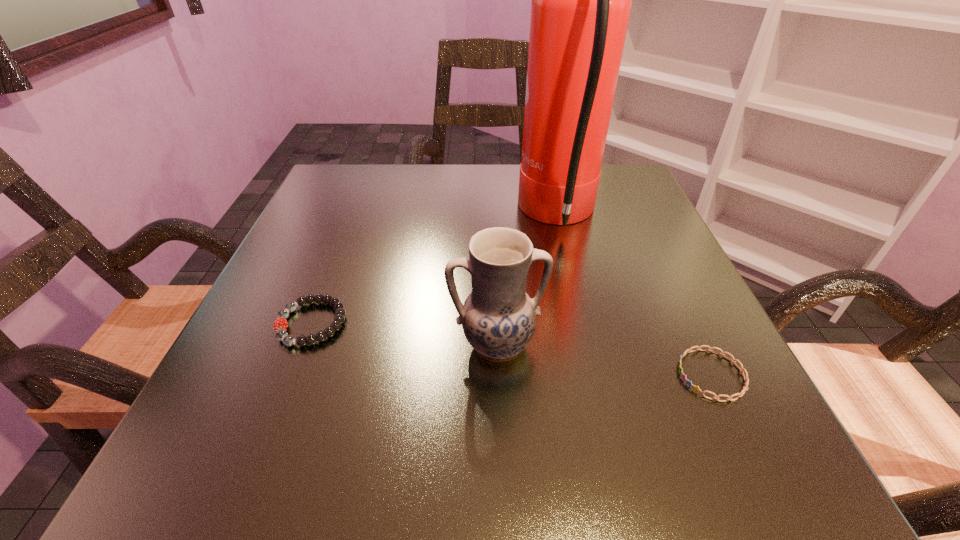
This screenshot has height=540, width=960. Find the location of `vacant space located 0.260m on the right of the pottery`. vacant space located 0.260m on the right of the pottery is located at coordinates (718, 345).

I want to click on free space located on the back of the leftmost object, so click(364, 190).

Identify the location of vacant area situated on the surface of the shorter bracelet showing star-shaped elements. (559, 375).

You are a GUI agent. You are given a task and a screenshot of the screen. Output one action in this format:
    pyautogui.click(x=<x>, y=<y>)
    Task: Click on the vacant space located 0.110m on the surface of the shorter bracelet showing star-shaped elements
    Image resolution: width=960 pixels, height=540 pixels.
    Given the screenshot: What is the action you would take?
    pyautogui.click(x=601, y=375)

Where is `vacant space situated on the surface of the shorter bracelet showing star-shaped elements`? This screenshot has width=960, height=540. vacant space situated on the surface of the shorter bracelet showing star-shaped elements is located at coordinates (644, 375).

Where is `object at the far edge`? The width and height of the screenshot is (960, 540). object at the far edge is located at coordinates (581, 0).

Find the location of a particular element. object that is at the left edge is located at coordinates (280, 325).

Identify the location of fire extinguisher located in the right edge section of the desktop. (581, 0).

Locate an element on the screen. This screenshot has height=540, width=960. bracelet that is at the right edge is located at coordinates (696, 388).

Locate an element on the screen. The height and width of the screenshot is (540, 960). object present at the far right corner is located at coordinates (x=581, y=0).